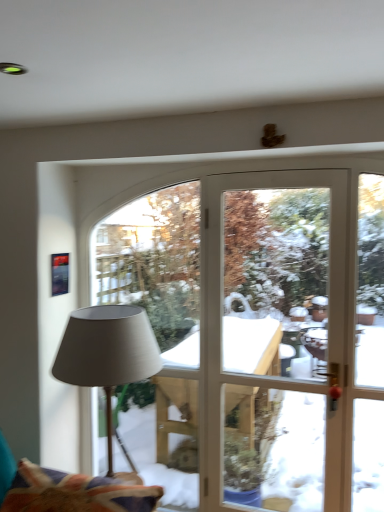
This screenshot has width=384, height=512. I want to click on matte gray fabric lamp at left, so click(107, 352).

The height and width of the screenshot is (512, 384). What do you see at coordinates (107, 352) in the screenshot?
I see `matte gray fabric lamp at left` at bounding box center [107, 352].

Where is `velvet fabric swivel chair at lower left`? velvet fabric swivel chair at lower left is located at coordinates (69, 489).

The height and width of the screenshot is (512, 384). Describe the element at coordinates (69, 489) in the screenshot. I see `velvet fabric swivel chair at lower left` at that location.

Find the location of a particular element. This screenshot has width=384, height=512. matte gray fabric lamp at left is located at coordinates (107, 352).

Can you confirm if velvet fabric swivel chair at lower left is positioned to the right of matte gray fabric lamp at left?

No, velvet fabric swivel chair at lower left is not to the right of matte gray fabric lamp at left.

Between velvet fabric swivel chair at lower left and matte gray fabric lamp at left, which one is positioned behind?

matte gray fabric lamp at left is further from the camera.

Which point is more distant from viewer, (94, 501) or (66, 362)?

The point (66, 362) is behind.

From the image's perspective, is velvet fabric swivel chair at lower left located above or below matte gray fabric lamp at left?

Based on their image positions, velvet fabric swivel chair at lower left is located beneath matte gray fabric lamp at left.

Consider the image. From a real-world perspective, between velvet fabric swivel chair at lower left and matte gray fabric lamp at left, who is vertically lower?

velvet fabric swivel chair at lower left is physically lower.

Considering the sizes of objects velvet fabric swivel chair at lower left and matte gray fabric lamp at left in the image provided, who is thinner, velvet fabric swivel chair at lower left or matte gray fabric lamp at left?

matte gray fabric lamp at left.

Does velvet fabric swivel chair at lower left have a lesser height compared to matte gray fabric lamp at left?

Yes.

Who is smaller, velvet fabric swivel chair at lower left or matte gray fabric lamp at left?

Smaller between the two is velvet fabric swivel chair at lower left.

Is velvet fabric swivel chair at lower left outside of matte gray fabric lamp at left?

Indeed, velvet fabric swivel chair at lower left is completely outside matte gray fabric lamp at left.

Are velvet fabric swivel chair at lower left and matte gray fabric lamp at left far apart?

velvet fabric swivel chair at lower left is near matte gray fabric lamp at left, not far away.

Is velvet fabric swivel chair at lower left aimed at matte gray fabric lamp at left?

No, velvet fabric swivel chair at lower left does not turn towards matte gray fabric lamp at left.

How far apart are velvet fabric swivel chair at lower left and matte gray fabric lamp at left?

velvet fabric swivel chair at lower left and matte gray fabric lamp at left are 17.69 inches apart from each other.

The width and height of the screenshot is (384, 512). In order to click on swivel chair that appears below the matte gray fabric lamp at left (from the image's perspective) in this screenshot , I will do `click(69, 489)`.

Which is more to the right, matte gray fabric lamp at left or velvet fabric swivel chair at lower left?

From the viewer's perspective, matte gray fabric lamp at left appears more on the right side.

Relative to velvet fabric swivel chair at lower left, is matte gray fabric lamp at left in front or behind?

matte gray fabric lamp at left is positioned farther from the viewer than velvet fabric swivel chair at lower left.

Does point (57, 365) appear closer or farther from the camera than point (18, 475)?

Point (57, 365) appears to be farther away from the viewer than point (18, 475).

From the image's perspective, is matte gray fabric lamp at left beneath velvet fabric swivel chair at lower left?

No.

From a real-world perspective, is matte gray fabric lamp at left located higher than velvet fabric swivel chair at lower left?

Yes, from a real-world perspective, matte gray fabric lamp at left is over velvet fabric swivel chair at lower left

In terms of width, does matte gray fabric lamp at left look wider or thinner when compared to velvet fabric swivel chair at lower left?

Clearly, matte gray fabric lamp at left has less width compared to velvet fabric swivel chair at lower left.

Considering the sizes of objects matte gray fabric lamp at left and velvet fabric swivel chair at lower left in the image provided, who is shorter, matte gray fabric lamp at left or velvet fabric swivel chair at lower left?

With less height is velvet fabric swivel chair at lower left.

Looking at this image, does matte gray fabric lamp at left have a smaller size compared to velvet fabric swivel chair at lower left?

Actually, matte gray fabric lamp at left might be larger than velvet fabric swivel chair at lower left.

Is matte gray fabric lamp at left not inside velvet fabric swivel chair at lower left?

Absolutely, matte gray fabric lamp at left is external to velvet fabric swivel chair at lower left.

In the scene shown: Is matte gray fabric lamp at left directly adjacent to velvet fabric swivel chair at lower left?

matte gray fabric lamp at left and velvet fabric swivel chair at lower left are not in contact.

Looking at this image, is matte gray fabric lamp at left facing away from velvet fabric swivel chair at lower left?

No, matte gray fabric lamp at left is not facing the opposite direction of velvet fabric swivel chair at lower left.

Find the location of a particular element. The image size is (384, 512). lamp behind the velvet fabric swivel chair at lower left is located at coordinates (107, 352).

Image resolution: width=384 pixels, height=512 pixels. I want to click on swivel chair below the matte gray fabric lamp at left (from a real-world perspective), so click(x=69, y=489).

Image resolution: width=384 pixels, height=512 pixels. What are the coordinates of `swivel chair below the matte gray fabric lamp at left (from the image's perspective)` in the screenshot? It's located at (69, 489).